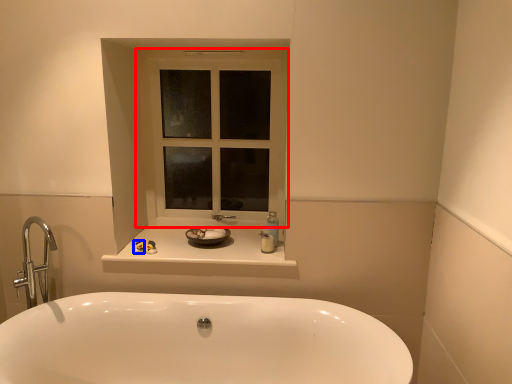
Question: Which object appears closest to the camera in this image, window (highlighted by a red box) or toiletry (highlighted by a blue box)?

Choices:
 (A) window
 (B) toiletry

Answer: (B)